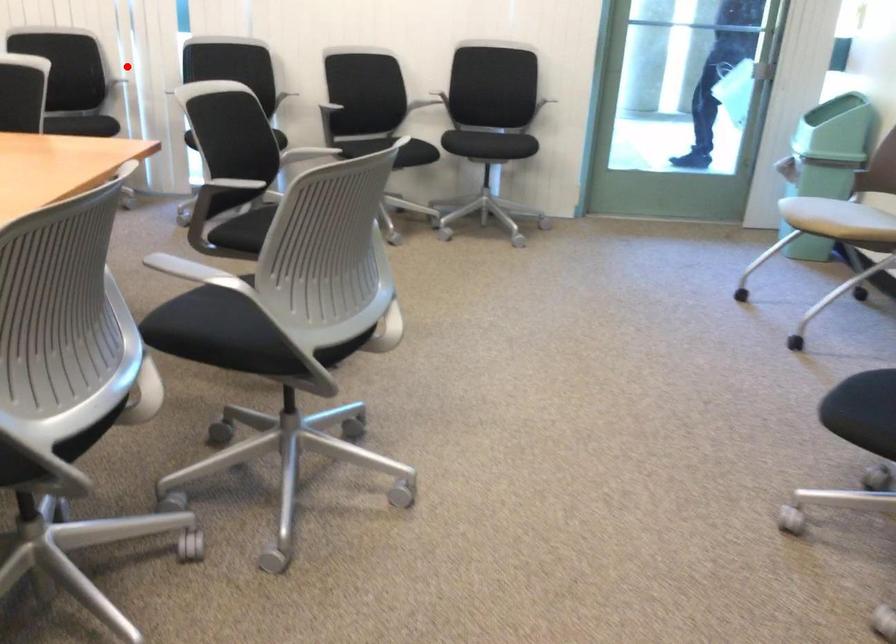
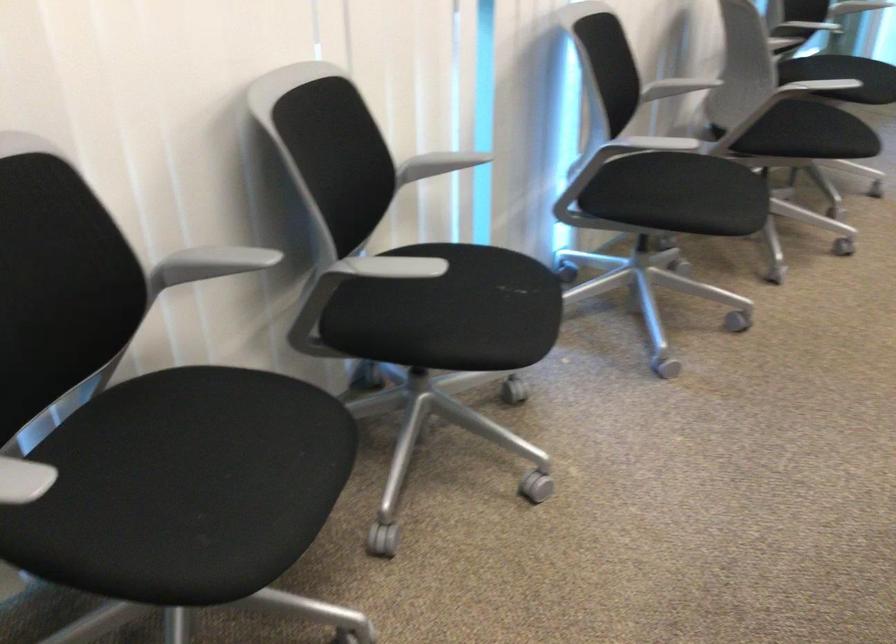
Where in the second image is the point corresponding to the highlighted location from the first image?

(438, 164)